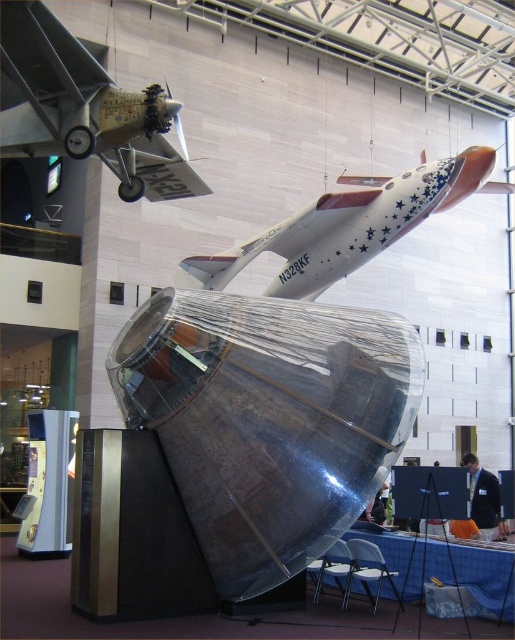
You are a visitor at the exhibition and want to take a photo of both the brushed metal airplane at upper left and the white glossy airplane at upper center. Which airplane should you position closer to in your camera frame to ensure both fit in the shot?

The brushed metal airplane at upper left is shorter than the white glossy airplane at upper center, so you should position closer to the white glossy airplane at upper center to accommodate its larger size within the camera frame.

You are a museum curator planning to install a new exhibit. You need to know which airplane is narrower between the brushed metal airplane at upper left and the white glossy airplane at upper center to decide placement. Which one is narrower?

The brushed metal airplane at upper left is narrower than the white glossy airplane at upper center according to the description.